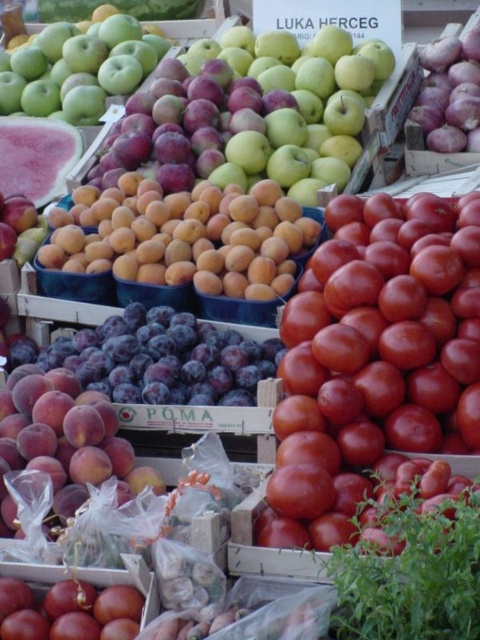
Does glossy red tomato at lower left have a smaller size compared to purple matte onion at upper right?

Correct, glossy red tomato at lower left occupies less space than purple matte onion at upper right.

This screenshot has height=640, width=480. Describe the element at coordinates (69, 611) in the screenshot. I see `glossy red tomato at lower left` at that location.

Describe the element at coordinates (69, 611) in the screenshot. The image size is (480, 640). I see `glossy red tomato at lower left` at that location.

This screenshot has width=480, height=640. What are the coordinates of `glossy red tomato at lower left` in the screenshot? It's located at (69, 611).

Can you confirm if glossy red tomato at center is taller than glossy red tomato at lower left?

Yes, glossy red tomato at center is taller than glossy red tomato at lower left.

The image size is (480, 640). Describe the element at coordinates (375, 368) in the screenshot. I see `glossy red tomato at center` at that location.

Where is `glossy red tomato at center`? The width and height of the screenshot is (480, 640). glossy red tomato at center is located at coordinates (375, 368).

Does glossy red tomato at center appear on the right side of purple matte onion at upper right?

Incorrect, glossy red tomato at center is not on the right side of purple matte onion at upper right.

Between glossy red tomato at center and purple matte onion at upper right, which one has more height?

glossy red tomato at center is taller.

Does point (348, 364) come closer to viewer compared to point (429, 134)?

That is True.

Where is `glossy red tomato at center`? The height and width of the screenshot is (640, 480). glossy red tomato at center is located at coordinates (375, 368).